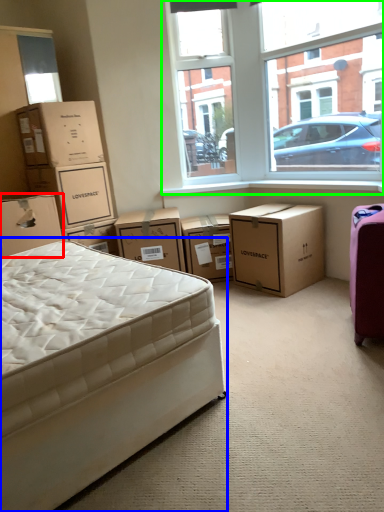
Question: Estimate the real-world distances between objects in this image. Which object is closer to box (highlighted by a red box), bed (highlighted by a blue box) or window (highlighted by a green box)?

Choices:
 (A) bed
 (B) window

Answer: (A)